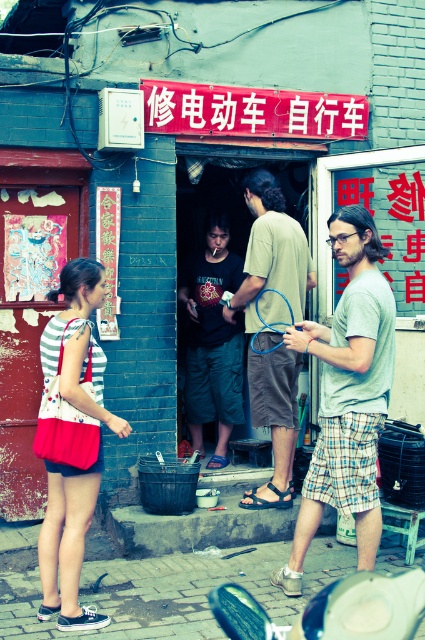
You are standing at the point marked as point (305, 483) and want to cross the street to reach a bus stop located on the opposite side. There is a traffic light ahead that turns green for 30 seconds. If you walk at a speed of 1.2 meters per second, will you be able to cross the street safely before the light turns red again?

The distance between you and the traffic light is not provided, so it is impossible to determine if you can cross safely based on the given information.

Based on the photo, you are standing at point (x=215, y=376) and want to walk to the shop entrance. Is the point (x=342, y=436) blocking your path?

Point (x=342, y=436) is in front of point (x=215, y=376), so yes, the point (x=342, y=436) is blocking your path to the shop entrance.

You are standing in front of the shop and want to hand a tool to the person wearing the brown fabric shorts at center. The tool you have is 1.5 meters long. Can you reach them without moving closer?

The brown fabric shorts at center is 5.32 meters away from the viewer. Since the tool is only 1.5 meters long, you cannot reach them without moving closer.